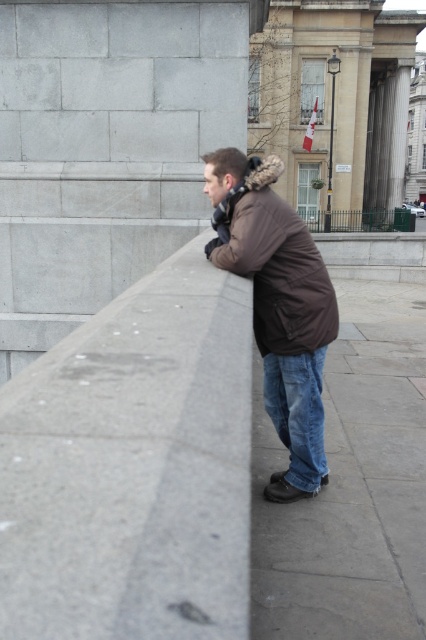
You are a drone operator trying to map coordinates in the image. You have two points marked as point 1 at (311, 536) and point 2 at (305, 493). According to the scene, which point is closer to the camera?

Point 1 at (311, 536) is closer to the camera because it is in front of point 2 at (305, 493).